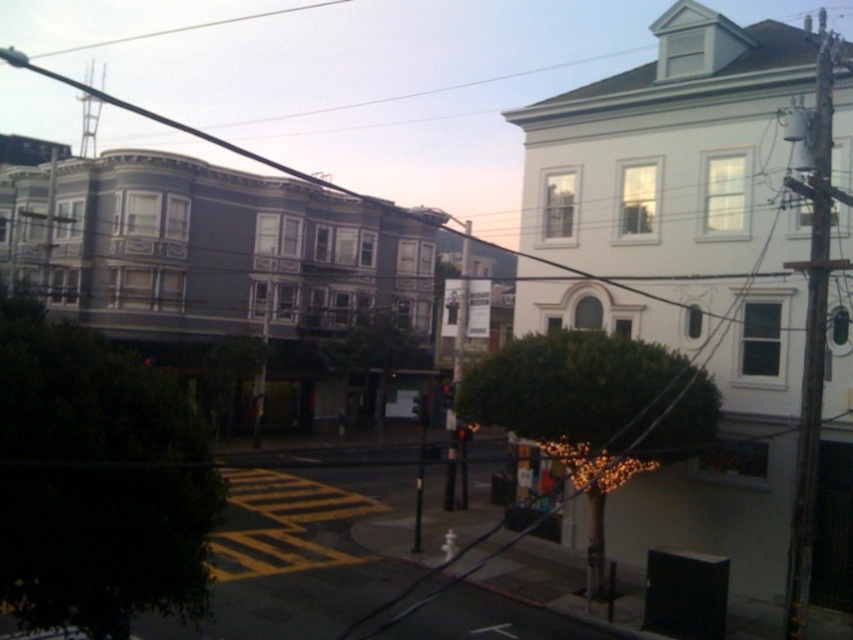
Question: Does wooden utility pole at right have a lesser width compared to red glass traffic light at center?

Choices:
 (A) yes
 (B) no

Answer: (B)

Question: Which point is farther to the camera?

Choices:
 (A) white wire at upper center
 (B) red glass traffic light at center
 (C) wooden utility pole at right

Answer: (A)

Question: Does wooden utility pole at right appear on the left side of white wire at upper center?

Choices:
 (A) yes
 (B) no

Answer: (B)

Question: Which point is farther to the camera?

Choices:
 (A) red glass traffic light at center
 (B) metallic pole at center

Answer: (A)

Question: Which point is closer to the camera taking this photo?

Choices:
 (A) (445, 400)
 (B) (793, 132)

Answer: (B)

Question: Is white wire at upper center positioned behind red glass traffic light at center?

Choices:
 (A) no
 (B) yes

Answer: (B)